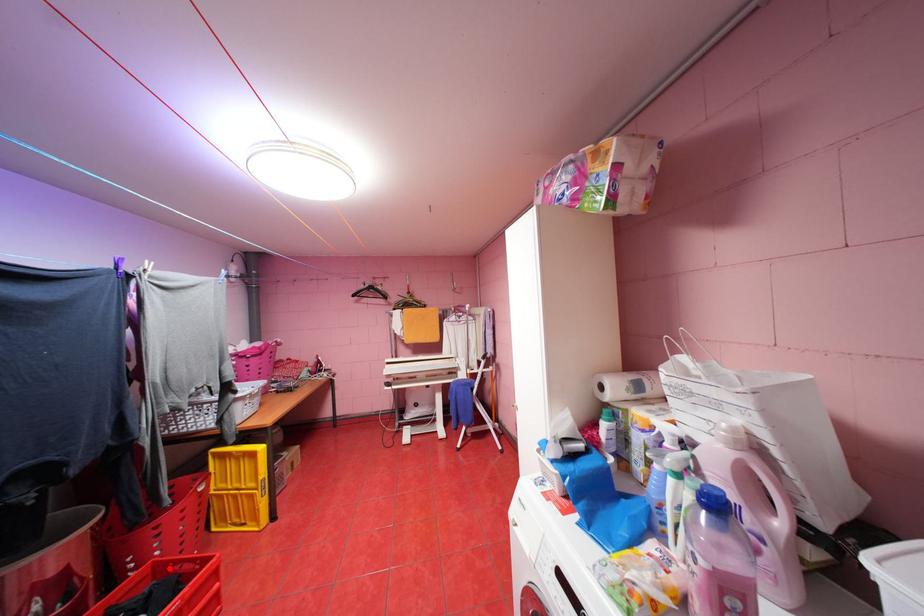
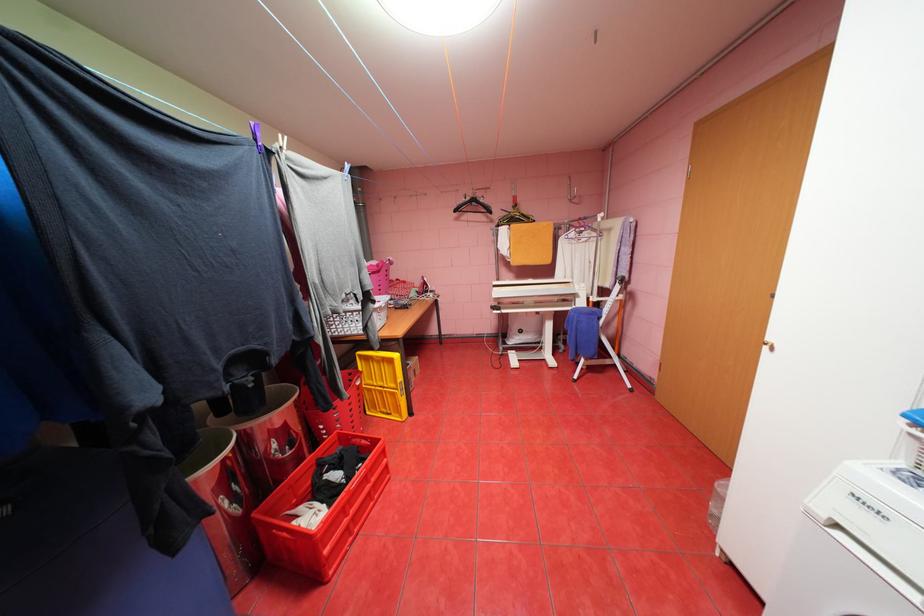
Question: I am providing you with two images of the same scene from different viewpoints. In image1, a red point is highlighted. Considering the same 3D point in image2, which of the following is correct?

Choices:
 (A) It is closer
 (B) It is farther

Answer: (A)